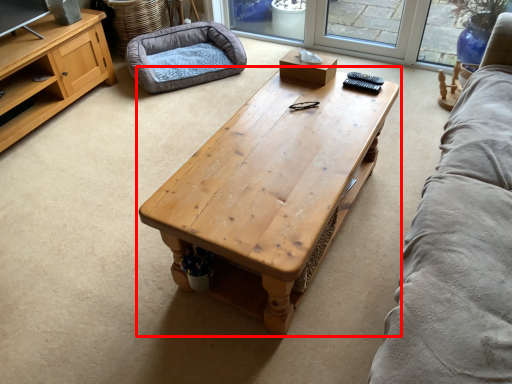
Question: From the image's perspective, what is the correct spatial relationship of coffee table (annotated by the red box) in relation to dog bed?

Choices:
 (A) below
 (B) above

Answer: (A)